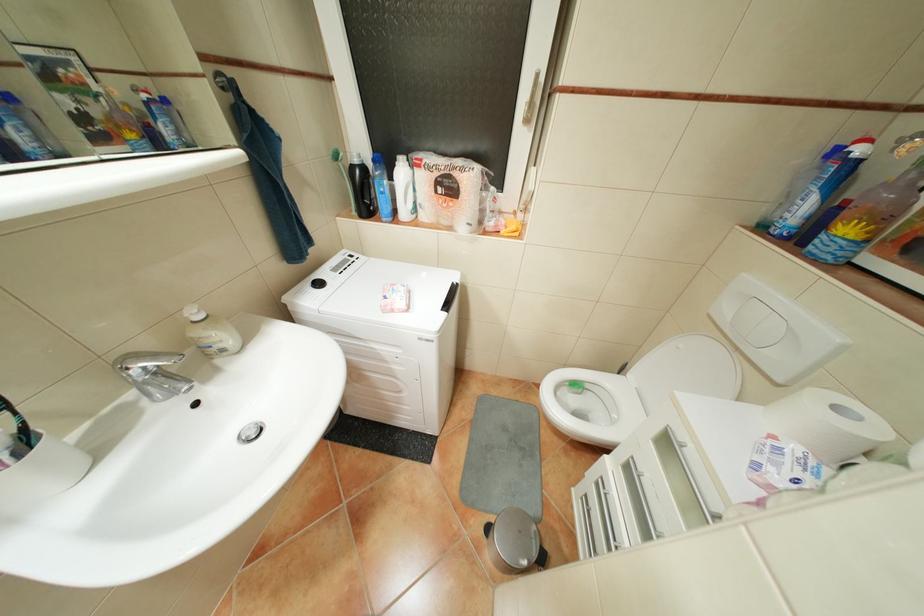
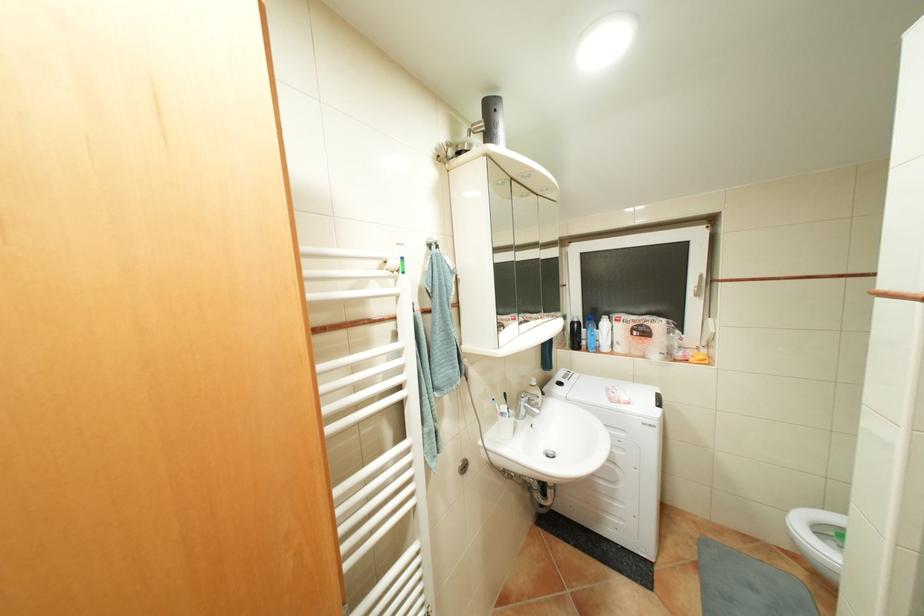
In the second image, find the point that corresponds to (x=500, y=224) in the first image.

(688, 354)